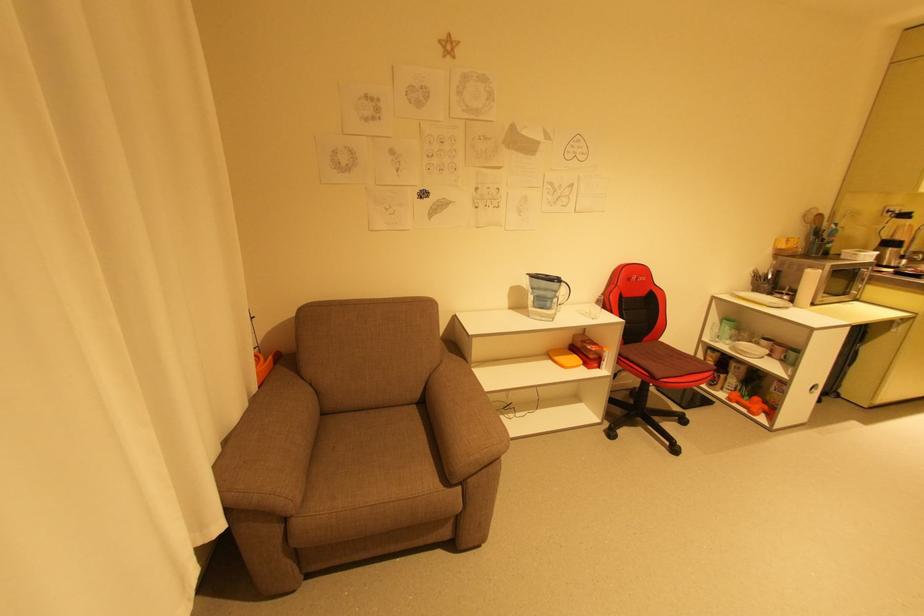
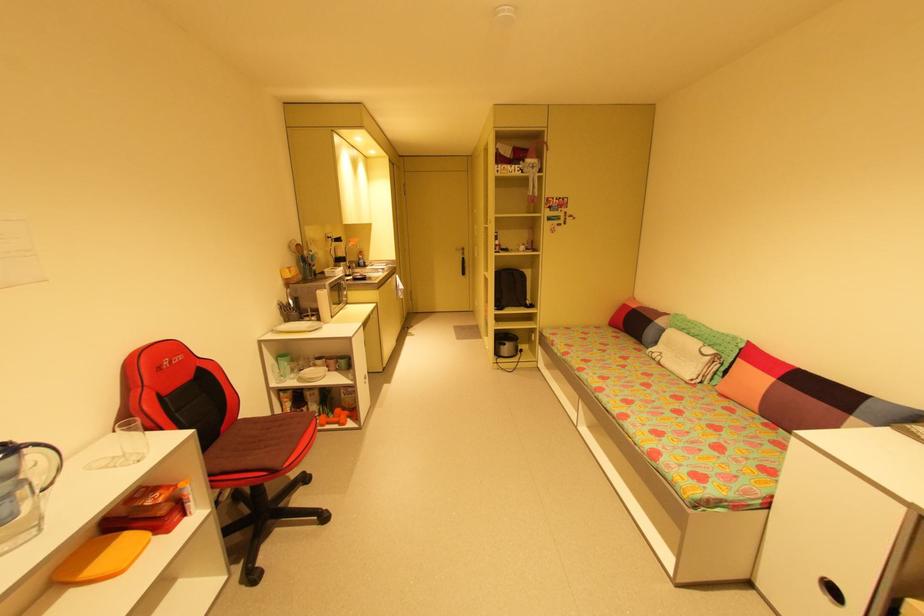
In the second image, find the point that corresponds to (x=567, y=284) in the first image.

(30, 450)